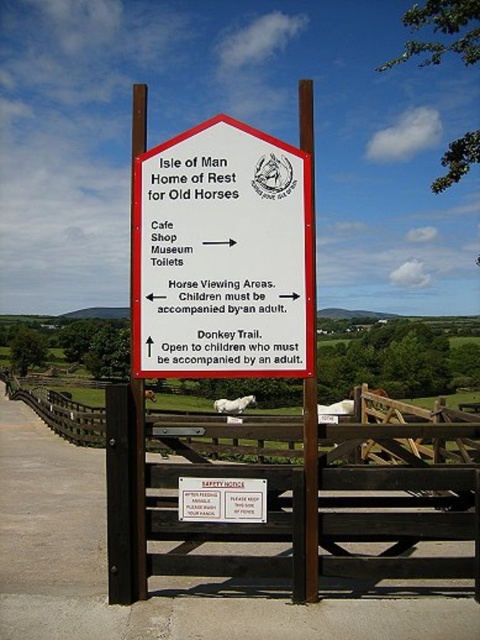
You are standing at the entrance of the Isle of Man Home of Rest for Old Horses and want to walk towards the wooden fence at center. There is a white wood post at center in your path. Can you pass between them without any issues?

The wooden fence at center and white wood post at center are 16.91 feet apart from each other, so yes, you can pass between them without any issues as the distance is sufficient.

You are standing in front of the Isle of Man Home of Rest for Old Horses entrance and need to read the white paper sign at center. Can you see the wooden fence at center behind the sign?

The white paper sign at center is further to the viewer than wooden fence at center, so yes, you can see the wooden fence at center behind the sign.